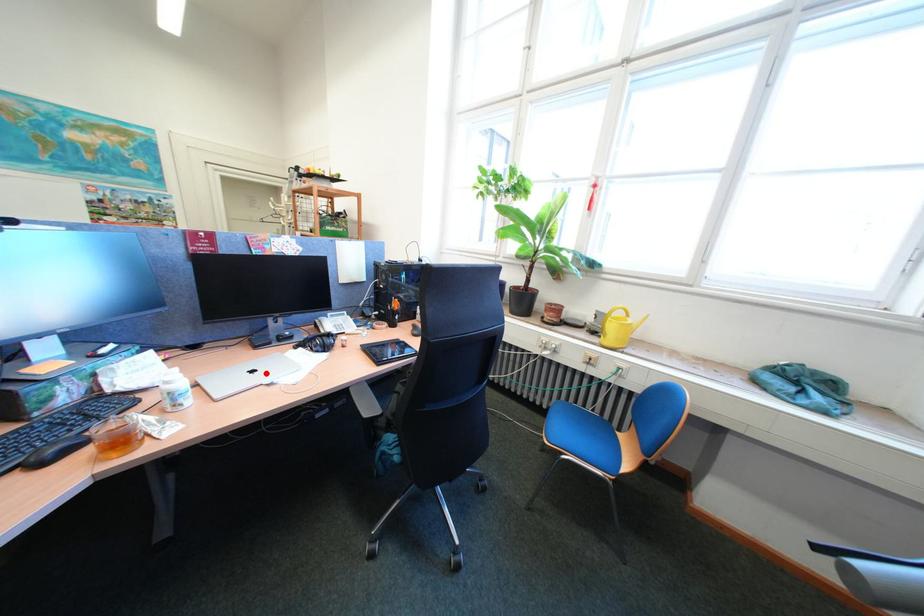
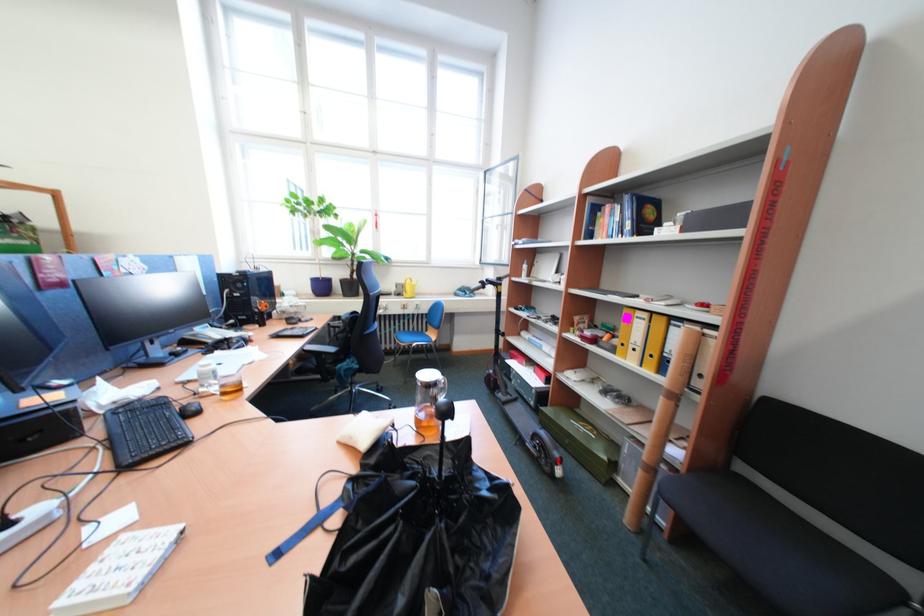
Question: I am providing you with two images of the same scene from different viewpoints. A red point is marked on the first image. Can you still see the location of the red point in image 2?

Choices:
 (A) Yes
 (B) No

Answer: (B)